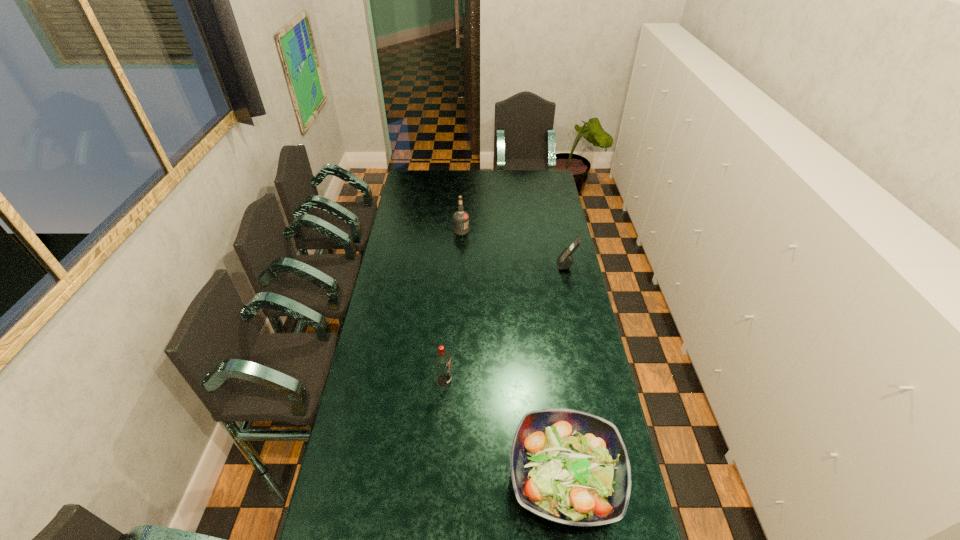
The image size is (960, 540). What are the coordinates of `empty space between the shortest object and the nearer vodka` in the screenshot? It's located at (505, 429).

At what (x,y) coordinates should I click in order to perform the action: click on empty location between the shortest object and the second nearest object. Please return your answer as a coordinate pair (x, y). The width and height of the screenshot is (960, 540). Looking at the image, I should click on (505, 429).

Identify the location of free space between the shortest object and the farther vodka. The height and width of the screenshot is (540, 960). (514, 354).

This screenshot has height=540, width=960. Find the location of `free space between the salad plate and the cellular telephone`. free space between the salad plate and the cellular telephone is located at coordinates (566, 371).

At what (x,y) coordinates should I click in order to perform the action: click on free point between the salad plate and the cellular telephone. Please return your answer as a coordinate pair (x, y). This screenshot has width=960, height=540. Looking at the image, I should click on (566, 371).

Image resolution: width=960 pixels, height=540 pixels. Find the location of `free space between the second farthest object and the nearer vodka`. free space between the second farthest object and the nearer vodka is located at coordinates (505, 323).

Find the location of `free space between the third farthest object and the salad plate`. free space between the third farthest object and the salad plate is located at coordinates tap(505, 429).

The height and width of the screenshot is (540, 960). Find the location of `vacant region between the nearer vodka and the third tallest object`. vacant region between the nearer vodka and the third tallest object is located at coordinates (505, 323).

Locate an element on the screen. free space that is in between the nearest object and the nearer vodka is located at coordinates (505, 429).

Identify the location of object that stands as the third closest to the salad plate. click(461, 218).